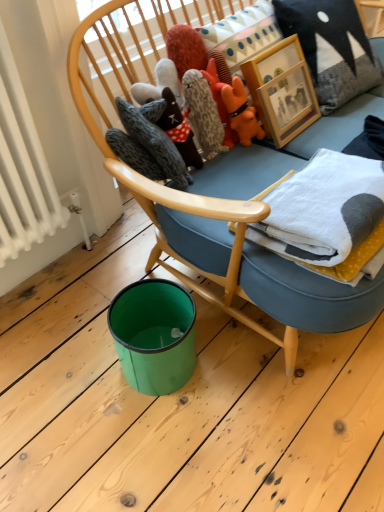
Question: Is wooden picture frame at upper center beside white fleece blanket at upper right?

Choices:
 (A) no
 (B) yes

Answer: (A)

Question: Considering the relative positions of wooden picture frame at upper center and white fleece blanket at upper right in the image provided, is wooden picture frame at upper center behind white fleece blanket at upper right?

Choices:
 (A) yes
 (B) no

Answer: (A)

Question: Is wooden picture frame at upper center taller than white fleece blanket at upper right?

Choices:
 (A) yes
 (B) no

Answer: (A)

Question: Does wooden picture frame at upper center appear on the left side of white fleece blanket at upper right?

Choices:
 (A) yes
 (B) no

Answer: (A)

Question: Is white fleece blanket at upper right surrounded by wooden picture frame at upper center?

Choices:
 (A) yes
 (B) no

Answer: (B)

Question: Would you say white fleece blanket at upper right is inside or outside textured gray pillow at upper right?

Choices:
 (A) inside
 (B) outside

Answer: (B)

Question: Is white fleece blanket at upper right in front of or behind textured gray pillow at upper right in the image?

Choices:
 (A) behind
 (B) front

Answer: (B)

Question: From the image's perspective, is white fleece blanket at upper right located above or below textured gray pillow at upper right?

Choices:
 (A) above
 (B) below

Answer: (B)

Question: Would you say white fleece blanket at upper right is to the left or to the right of textured gray pillow at upper right in the picture?

Choices:
 (A) left
 (B) right

Answer: (A)

Question: Is wooden picture frame at upper center spatially inside textured gray pillow at upper right, or outside of it?

Choices:
 (A) inside
 (B) outside

Answer: (A)

Question: Considering their positions, is wooden picture frame at upper center located in front of or behind textured gray pillow at upper right?

Choices:
 (A) front
 (B) behind

Answer: (A)

Question: Based on their sizes in the image, would you say wooden picture frame at upper center is bigger or smaller than textured gray pillow at upper right?

Choices:
 (A) big
 (B) small

Answer: (B)

Question: Is wooden picture frame at upper center taller or shorter than textured gray pillow at upper right?

Choices:
 (A) tall
 (B) short

Answer: (B)

Question: From a real-world perspective, relative to fluffy gray plush at upper center, is orange plush toy at upper center, which is the 1th toy from right to left, vertically above or below?

Choices:
 (A) below
 (B) above

Answer: (A)

Question: Considering the positions of orange plush toy at upper center, which is the 1th toy from right to left, and fluffy gray plush at upper center in the image, is orange plush toy at upper center, which is the 1th toy from right to left, bigger or smaller than fluffy gray plush at upper center?

Choices:
 (A) big
 (B) small

Answer: (A)